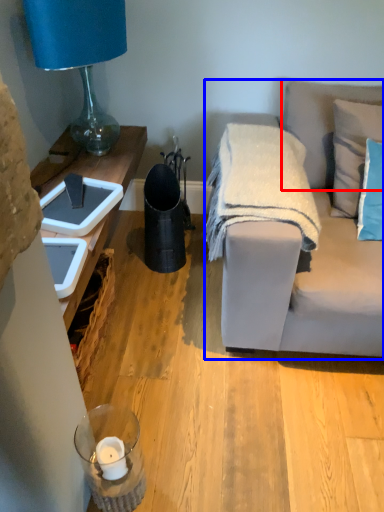
Question: Among these objects, which one is farthest to the camera, pillow (highlighted by a red box) or studio couch (highlighted by a blue box)?

Choices:
 (A) pillow
 (B) studio couch

Answer: (A)